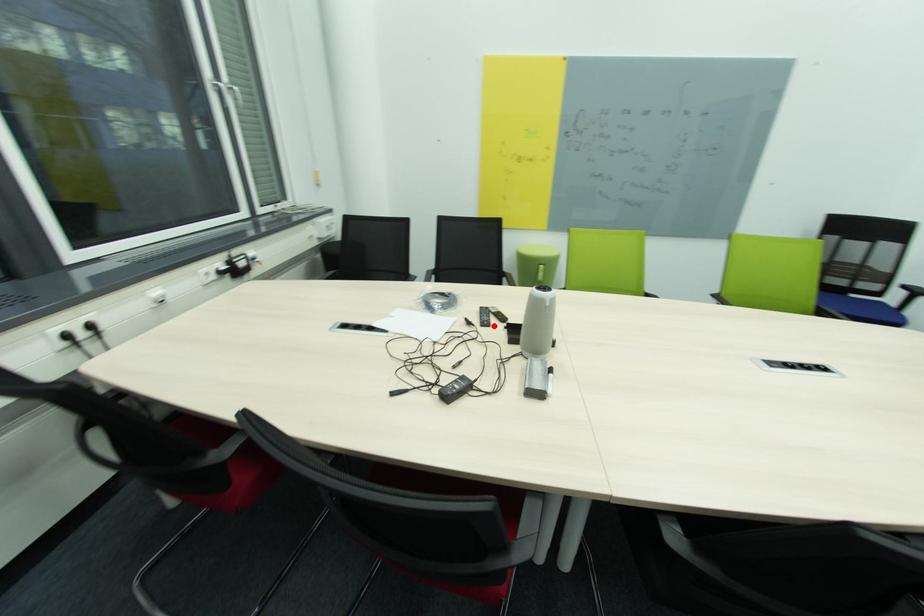
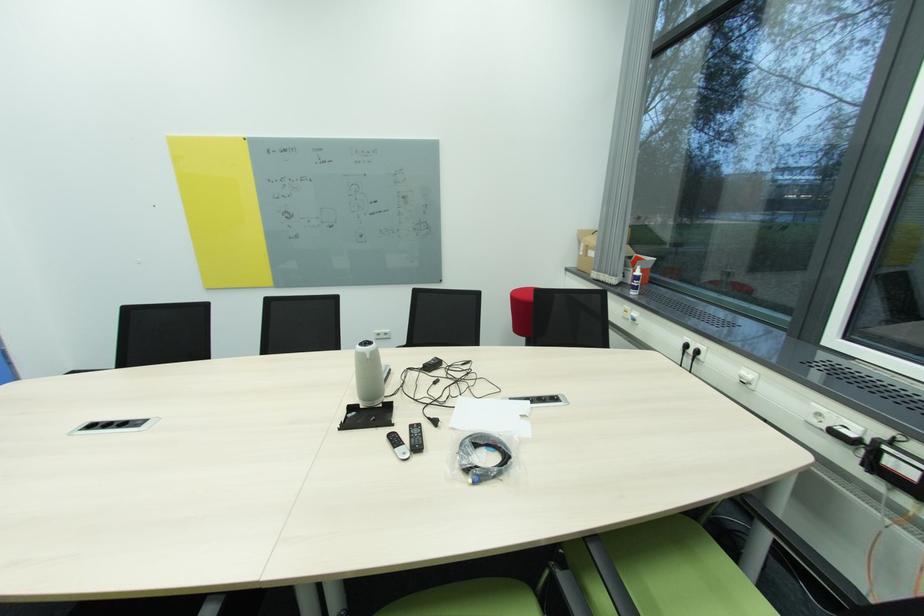
Where in the second image is the point corresponding to the highlighted location from the first image?

(416, 427)